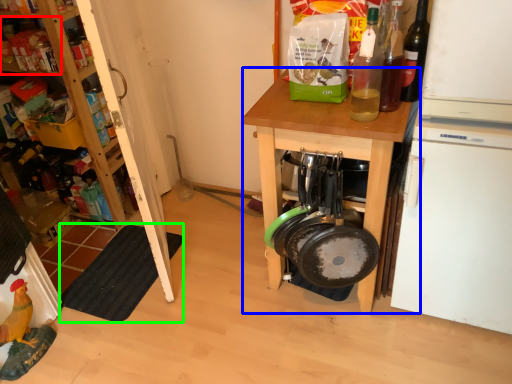
Question: Based on their relative distances, which object is farther from shelf (highlighted by a red box)? Choose from desk (highlighted by a blue box) and mat (highlighted by a green box).

Choices:
 (A) desk
 (B) mat

Answer: (A)